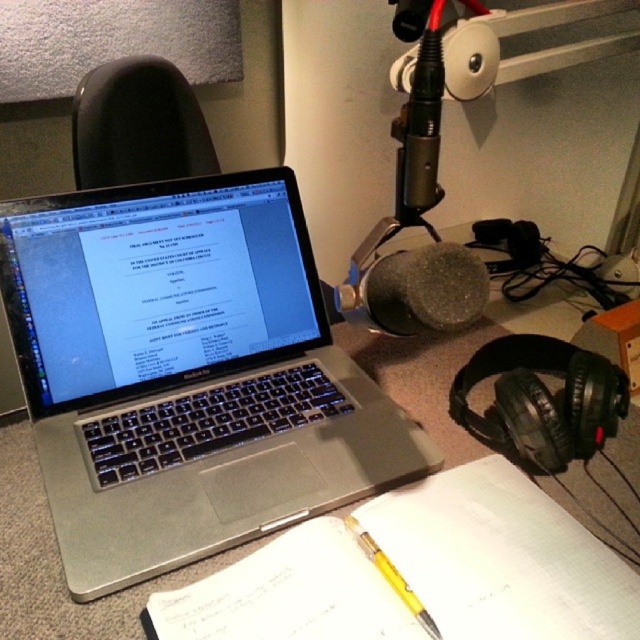
Is white paper at center closer to camera compared to black matte headphones at right?

Yes.

Identify the location of white paper at center. Image resolution: width=640 pixels, height=640 pixels. (420, 572).

Is white paper at center to the right of spongy gray microphone at center from the viewer's perspective?

No, white paper at center is not to the right of spongy gray microphone at center.

At what (x,y) coordinates should I click in order to perform the action: click on white paper at center. Please return your answer as a coordinate pair (x, y). Looking at the image, I should click on (420, 572).

Which is above, black matte headphones at right or yellow translucent pencil at center?

black matte headphones at right is above.

Can you confirm if black matte headphones at right is bigger than yellow translucent pencil at center?

Correct, black matte headphones at right is larger in size than yellow translucent pencil at center.

Where is `black matte headphones at right`? The width and height of the screenshot is (640, 640). black matte headphones at right is located at coordinates (541, 400).

Locate an element on the screen. This screenshot has width=640, height=640. black matte headphones at right is located at coordinates (541, 400).